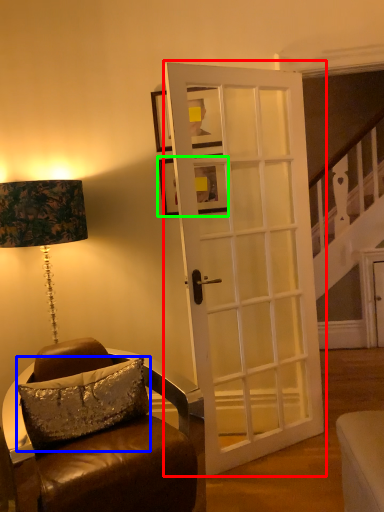
Question: Which object is the closest to the door (highlighted by a red box)? Choose among these: pillow (highlighted by a blue box) or picture frame (highlighted by a green box).

Choices:
 (A) pillow
 (B) picture frame

Answer: (B)